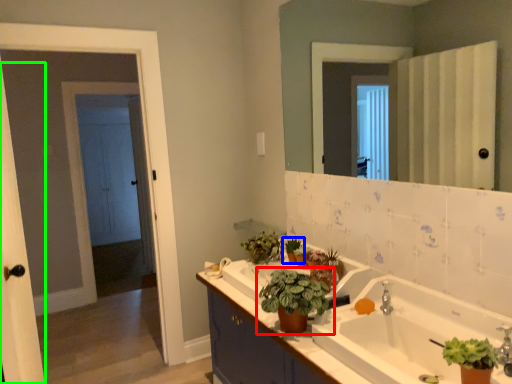
Question: Which object is the farthest from houseplant (highlighted by a red box)? Choose among these: houseplant (highlighted by a blue box) or screen door (highlighted by a green box).

Choices:
 (A) houseplant
 (B) screen door

Answer: (B)